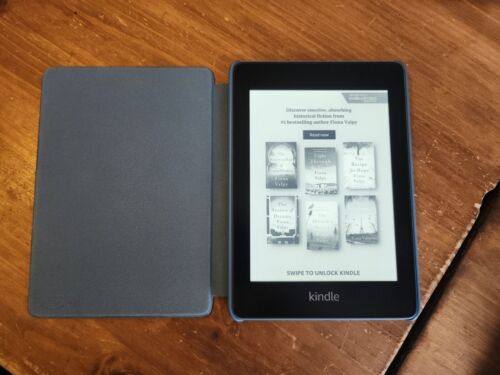
Find the location of `pull out workspace`. pull out workspace is located at coordinates 456,322.